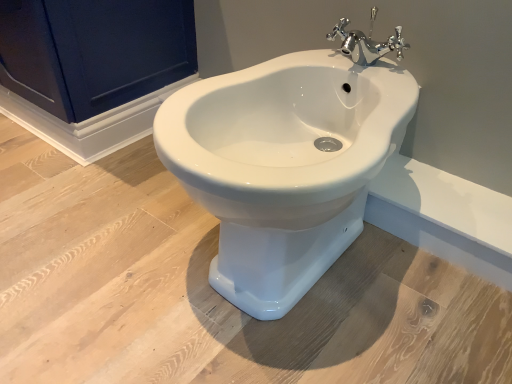
Question: Does chrome metallic faucet at upper center have a smaller size compared to matte dark blue cabinet at upper left?

Choices:
 (A) yes
 (B) no

Answer: (A)

Question: From the image's perspective, is chrome metallic faucet at upper center on matte dark blue cabinet at upper left?

Choices:
 (A) no
 (B) yes

Answer: (A)

Question: Is chrome metallic faucet at upper center at the left side of matte dark blue cabinet at upper left?

Choices:
 (A) no
 (B) yes

Answer: (A)

Question: Is chrome metallic faucet at upper center taller than matte dark blue cabinet at upper left?

Choices:
 (A) no
 (B) yes

Answer: (A)

Question: From a real-world perspective, is chrome metallic faucet at upper center below matte dark blue cabinet at upper left?

Choices:
 (A) no
 (B) yes

Answer: (A)

Question: Choose the correct answer: Is chrome metallic faucet at upper center inside white glossy bidet at center or outside it?

Choices:
 (A) outside
 (B) inside

Answer: (B)

Question: Considering the positions of point (357, 34) and point (196, 198), is point (357, 34) closer or farther from the camera than point (196, 198)?

Choices:
 (A) farther
 (B) closer

Answer: (A)

Question: Relative to white glossy bidet at center, is chrome metallic faucet at upper center in front or behind?

Choices:
 (A) front
 (B) behind

Answer: (B)

Question: Looking at the image, does chrome metallic faucet at upper center seem bigger or smaller compared to white glossy bidet at center?

Choices:
 (A) big
 (B) small

Answer: (B)

Question: Would you say matte dark blue cabinet at upper left is inside or outside white glossy bidet at center?

Choices:
 (A) outside
 (B) inside

Answer: (A)

Question: Considering the relative positions of matte dark blue cabinet at upper left and white glossy bidet at center in the image provided, is matte dark blue cabinet at upper left to the left or to the right of white glossy bidet at center?

Choices:
 (A) right
 (B) left

Answer: (B)

Question: From the image's perspective, is matte dark blue cabinet at upper left located above or below white glossy bidet at center?

Choices:
 (A) below
 (B) above

Answer: (B)

Question: Looking at their shapes, would you say matte dark blue cabinet at upper left is wider or thinner than white glossy bidet at center?

Choices:
 (A) thin
 (B) wide

Answer: (A)

Question: From the image's perspective, is chrome metallic faucet at upper center positioned above or below matte dark blue cabinet at upper left?

Choices:
 (A) below
 (B) above

Answer: (A)

Question: Would you say chrome metallic faucet at upper center is to the left or to the right of matte dark blue cabinet at upper left in the picture?

Choices:
 (A) right
 (B) left

Answer: (A)